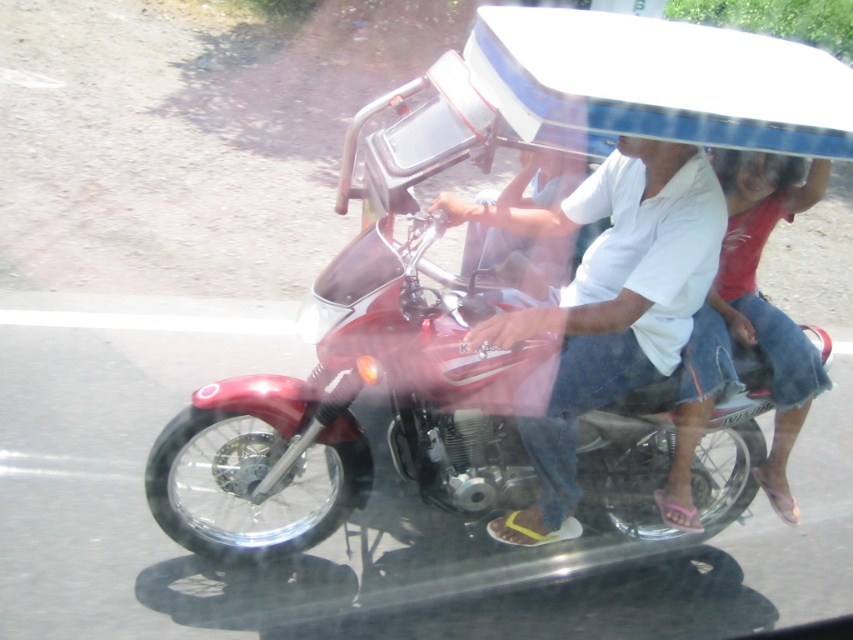
You are a delivery person who needs to place a small package between the metallic red motorcycle at center and the denim shorts at center. Given that the package requires 24 inches of space, will there be enough room?

A: The distance between the metallic red motorcycle at center and the denim shorts at center is 26.55 inches, which is more than the required 24 inches. Therefore, there is enough space to place the package between them.

You are a photographer trying to capture a clear photo of the white cotton shirt at center and denim shorts at center. Which one should you focus on first if you want to ensure both are in focus?

The white cotton shirt at center is above denim shorts at center, so you should focus on the white cotton shirt at center first to ensure both are in focus.

You are a delivery person who needs to attach a GPS tracker to the metallic red motorcycle at center. The GPS tracker requires a minimum of 18 inches of space from the white cotton shirt at center to function properly. Based on the scene, can the GPS tracker be placed on the motorcycle without interfering with the shirt?

The distance between the metallic red motorcycle at center and the white cotton shirt at center is 15.74 inches. Since this is less than the required 18 inches, the GPS tracker cannot be placed on the motorcycle without interfering with the shirt.